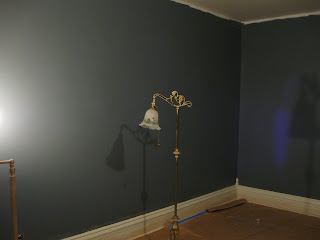
Where is `glass lamp`? glass lamp is located at coordinates (152, 126).